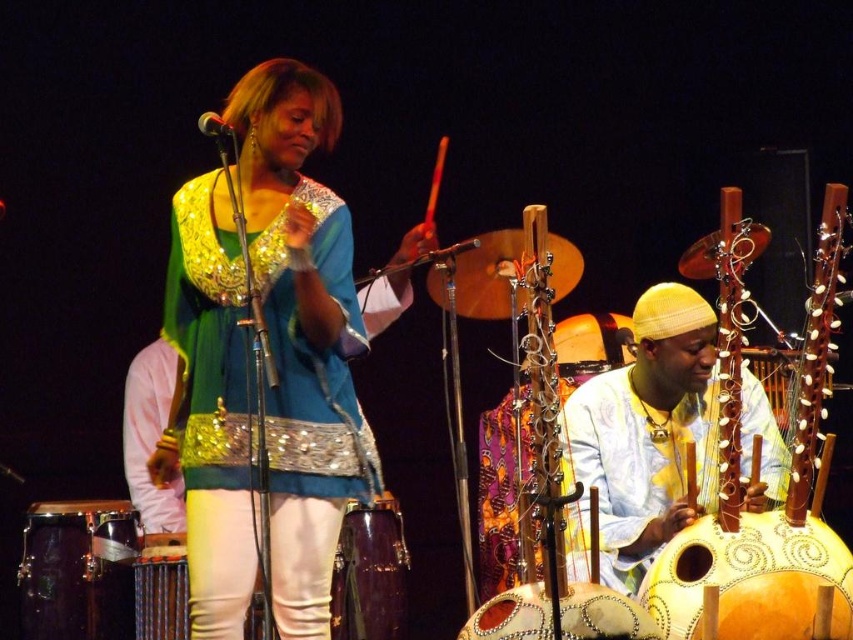
Can you confirm if shiny sequined top at center is positioned below shiny gold drum at lower center?

Actually, shiny sequined top at center is above shiny gold drum at lower center.

Is point (186, 230) positioned behind point (473, 612)?

Yes, it is.

This screenshot has height=640, width=853. I want to click on shiny sequined top at center, so click(302, 332).

Does light blue fabric at center have a lesser height compared to wooden drum at center?

In fact, light blue fabric at center may be taller than wooden drum at center.

Is the position of light blue fabric at center less distant than that of wooden drum at center?

No, it is not.

Describe the element at coordinates (643, 436) in the screenshot. Image resolution: width=853 pixels, height=640 pixels. I see `light blue fabric at center` at that location.

Find the location of a particular element. light blue fabric at center is located at coordinates (643, 436).

Which is behind, point (177, 536) or point (222, 122)?

The point (177, 536) is behind.

Identify the location of wooden drum at center. The width and height of the screenshot is (853, 640). (161, 588).

Is point (178, 584) closer to camera compared to point (213, 115)?

No, (178, 584) is behind (213, 115).

Locate an element on the screen. This screenshot has height=640, width=853. wooden drum at center is located at coordinates (161, 588).